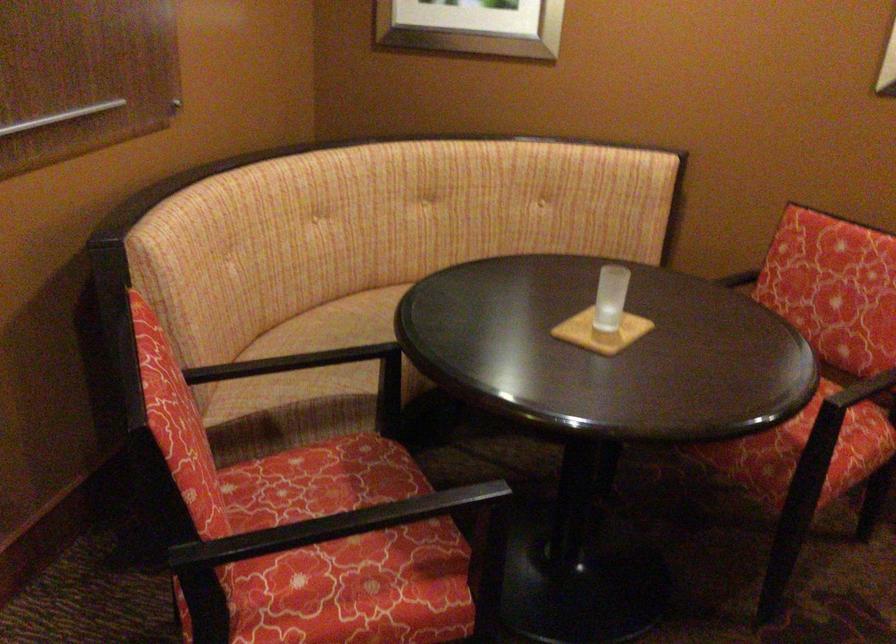
First-person continuous shooting, in which direction is the camera rotating?

The rotation direction of the camera is left-down.